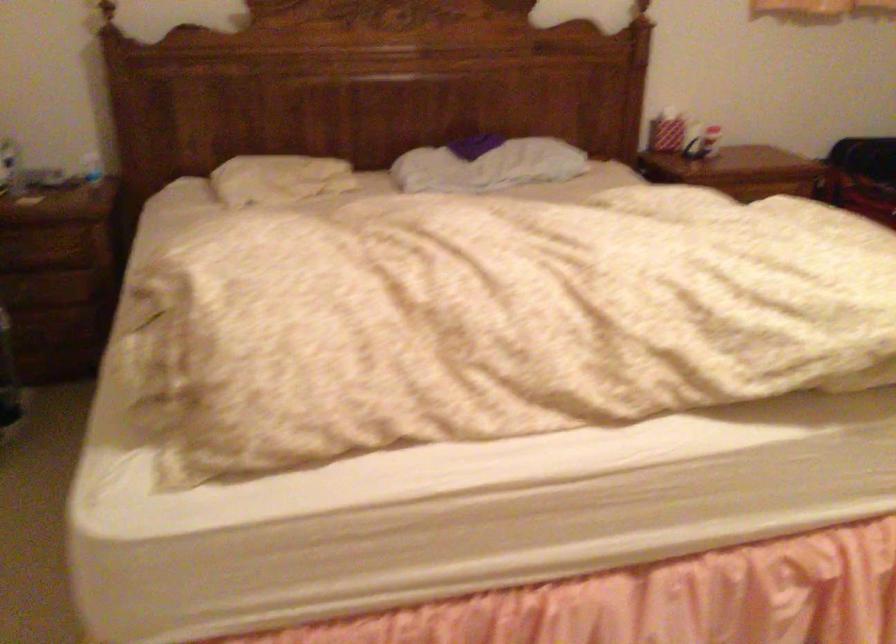
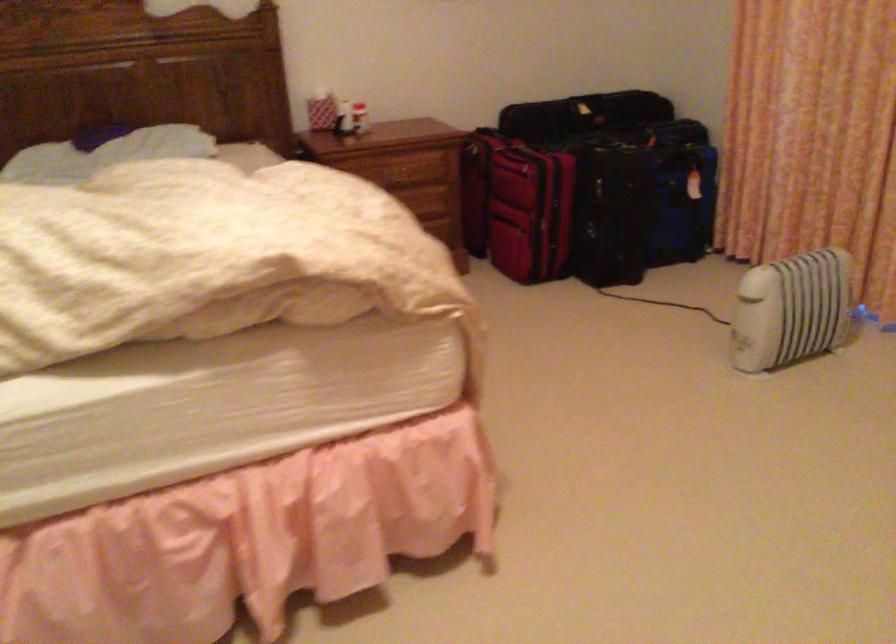
Question: In a continuous first-person perspective shot, in which direction is the camera moving?

Choices:
 (A) Left
 (B) Right
 (C) Forward
 (D) Backward

Answer: (B)